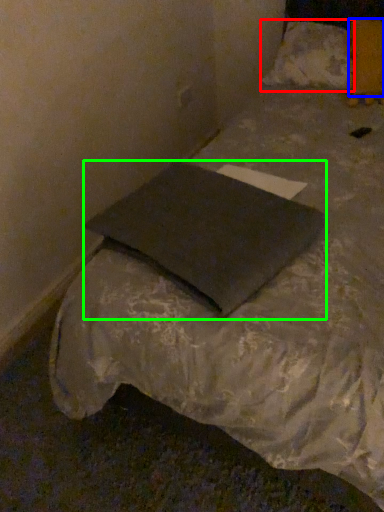
Question: Which object is positioned farthest from pillow (highlighted by a red box)? Select from pillow (highlighted by a blue box) and pillow (highlighted by a green box).

Choices:
 (A) pillow
 (B) pillow

Answer: (B)